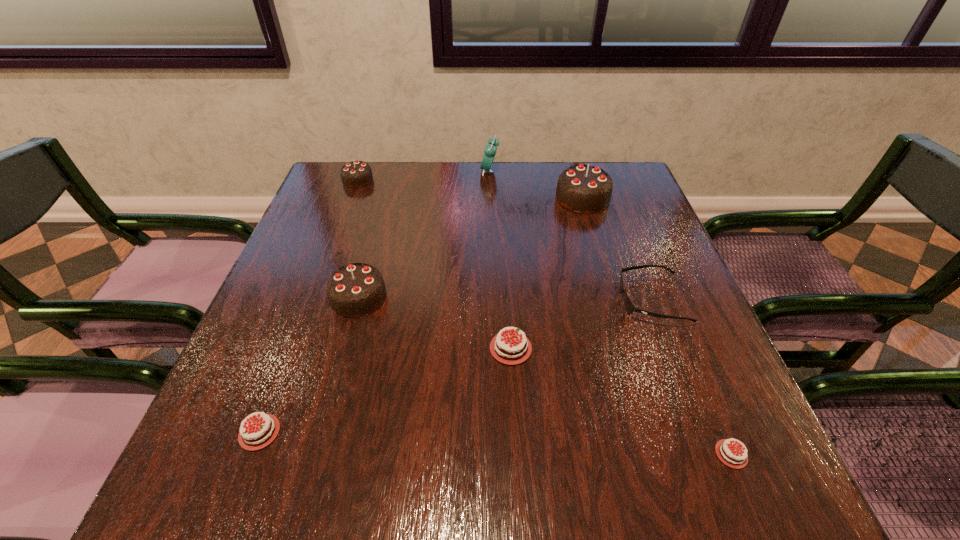
Identify the location of chocolate cake that is the third closest one to the shortest object. (355, 290).

You are a GUI agent. You are given a task and a screenshot of the screen. Output one action in this format:
    pyautogui.click(x=<x>, y=<y>)
    Task: Click on the chocolate chocolate cake that stands as the closest to the alarm clock
    The width and height of the screenshot is (960, 540).
    Given the screenshot: What is the action you would take?
    pyautogui.click(x=586, y=189)

Locate which chocolate chocolate cake ranks third in proximity to the sunglasses. Please provide its 2D coordinates. Your answer should be formatted as a tuple, i.e. [(x, y)], where the tuple contains the x and y coordinates of a point satisfying the conditions above.

[(355, 174)]

Identify which red chocolate cake is the closest to the second shortest chocolate cake. Please provide its 2D coordinates. Your answer should be formatted as a tuple, i.e. [(x, y)], where the tuple contains the x and y coordinates of a point satisfying the conditions above.

[(513, 350)]

Find the location of a particular element. The image size is (960, 540). the second closest red chocolate cake relative to the shortest chocolate cake is located at coordinates (259, 434).

Image resolution: width=960 pixels, height=540 pixels. Identify the location of vacant space that satisfies the following two spatial constraints: 1. on the face of the alarm clock; 2. on the left side of the rightmost red chocolate cake. (498, 454).

Locate an element on the screen. This screenshot has height=540, width=960. free space that satisfies the following two spatial constraints: 1. on the front-facing side of the black sunglasses; 2. on the front side of the second shortest chocolate cake is located at coordinates (702, 433).

Find the location of a particular element. This screenshot has width=960, height=540. free space that satisfies the following two spatial constraints: 1. on the face of the alarm clock; 2. on the back side of the biggest red chocolate cake is located at coordinates (494, 348).

At what (x,y) coordinates should I click in order to perform the action: click on vacant space that satisfies the following two spatial constraints: 1. on the front side of the smallest chocolate chocolate cake; 2. on the left side of the rightmost red chocolate cake. Please return your answer as a coordinate pair (x, y). This screenshot has width=960, height=540. Looking at the image, I should click on (256, 454).

Locate an element on the screen. Image resolution: width=960 pixels, height=540 pixels. vacant region that satisfies the following two spatial constraints: 1. on the back side of the second smallest chocolate chocolate cake; 2. on the left side of the second shortest chocolate cake is located at coordinates (311, 298).